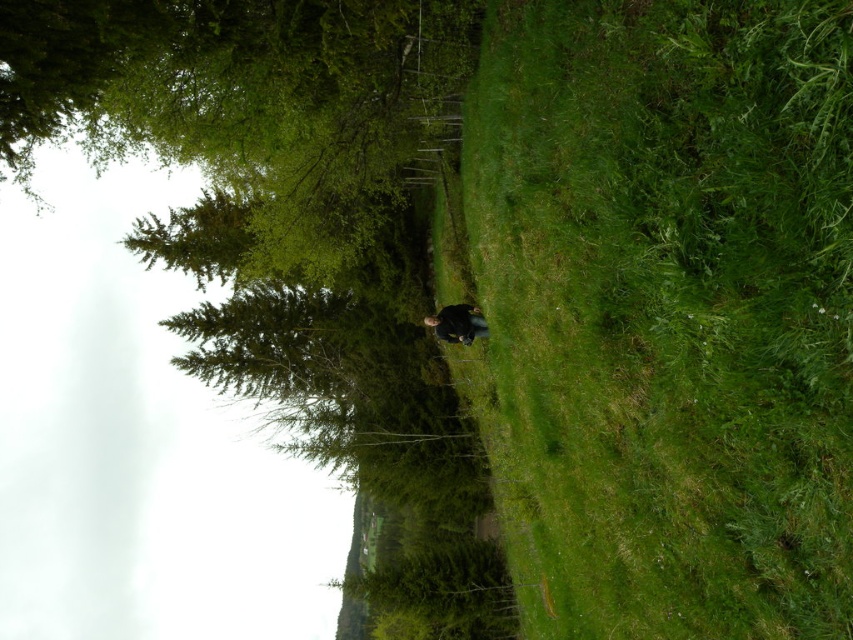
Is green grassy at center above green leafy tree at upper left?

Actually, green grassy at center is below green leafy tree at upper left.

Between point (618, 54) and point (35, 97), which one is positioned in front?

Positioned in front is point (618, 54).

Locate an element on the screen. Image resolution: width=853 pixels, height=640 pixels. green grassy at center is located at coordinates (668, 310).

Between point (595, 460) and point (453, 324), which one is positioned behind?

Positioned behind is point (453, 324).

Between green grassy at center and dark blue jacket at center, which one is positioned lower?

green grassy at center is lower down.

This screenshot has width=853, height=640. I want to click on green grassy at center, so click(668, 310).

Identify the location of green grassy at center. The height and width of the screenshot is (640, 853). (668, 310).

In the scene shown: Is green leafy tree at upper left taller than dark blue jacket at center?

Correct, green leafy tree at upper left is much taller as dark blue jacket at center.

Between point (360, 214) and point (444, 323), which one is positioned in front?

Point (444, 323)

Does point (88, 26) come in front of point (442, 308)?

Yes, it is in front of point (442, 308).

At what (x,y) coordinates should I click in order to perform the action: click on green leafy tree at upper left. Please return your answer as a coordinate pair (x, y). Looking at the image, I should click on (242, 100).